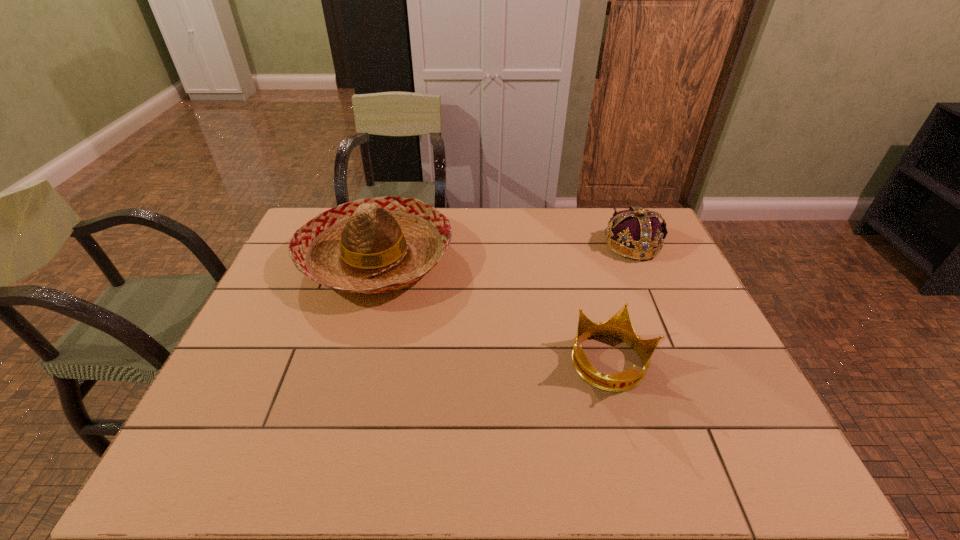
At what (x,y) coordinates should I click in order to perform the action: click on crown situated at the far edge. Please return your answer as a coordinate pair (x, y). The image size is (960, 540). Looking at the image, I should click on coord(641,236).

Where is `object located in the left edge section of the desktop`? This screenshot has width=960, height=540. object located in the left edge section of the desktop is located at coordinates (383, 244).

Where is `object present at the right edge`? The width and height of the screenshot is (960, 540). object present at the right edge is located at coordinates (641, 236).

At what (x,y) coordinates should I click in order to perform the action: click on object that is at the far left corner. Please return your answer as a coordinate pair (x, y). This screenshot has height=540, width=960. Looking at the image, I should click on (383, 244).

I want to click on object that is at the far right corner, so click(x=641, y=236).

In the image, there is a desktop. Where is `vacant space at the far edge`? vacant space at the far edge is located at coordinates (469, 212).

In order to click on free space at the near edge of the desktop in this screenshot , I will do `click(681, 455)`.

In the image, there is a desktop. Where is `free space at the left edge`? The height and width of the screenshot is (540, 960). free space at the left edge is located at coordinates (273, 367).

Where is `vacant point at the right edge`? vacant point at the right edge is located at coordinates 691,293.

Locate an element on the screen. Image resolution: width=960 pixels, height=540 pixels. blank area at the near right corner is located at coordinates (718, 440).